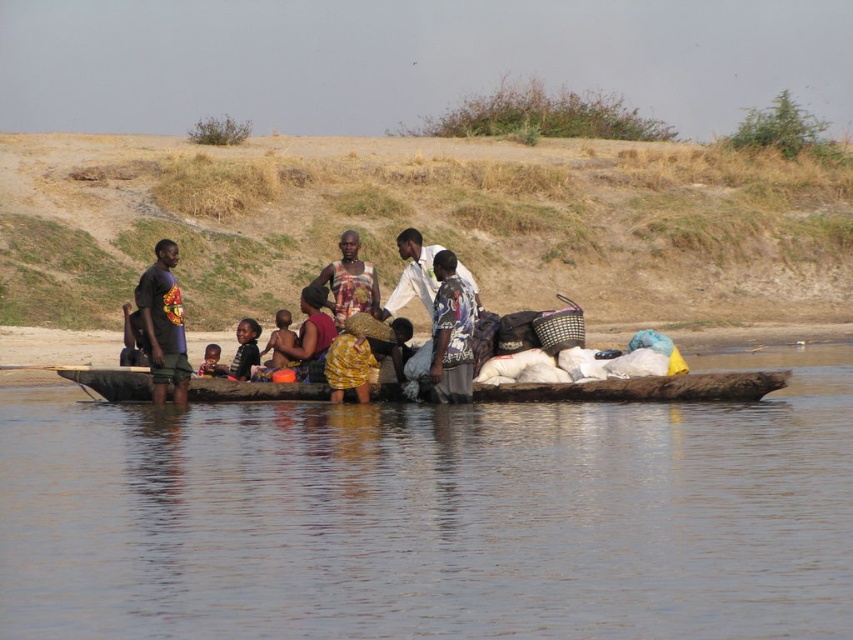
You are navigating a raft on the water and need to reach a destination. You notice two points marked on your map corresponding to the coordinates point (x=374, y=595) and point (x=175, y=358). According to the scene, which point is closer to your current position on the raft?

Point (x=374, y=595) is in front of point (x=175, y=358), so the point closer to your current position on the raft is point (x=374, y=595).

You are navigating a raft and need to reach a destination located at point A, which is at point (656, 397). There is an obstacle at point B, which is at point (329, 268). Based on the scene description, which point is closer to your current position if you are facing forward?

Point A at (656, 397) is in front of point B at (329, 268), so if you are facing forward, point A is closer to your current position.

Consider the image. You are navigating a map of the scene and need to locate the brown wooden canoe at center. What are its coordinates?

The brown wooden canoe at center is located at point coordinates (x=643, y=388).